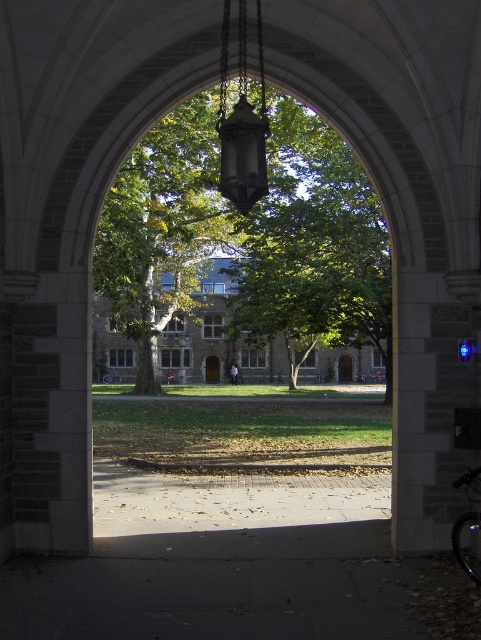
Question: Among these objects, which one is nearest to the camera?

Choices:
 (A) matte black lantern at center
 (B) green leafy tree at center

Answer: (A)

Question: Can you confirm if green leafy tree at center is smaller than matte black lantern at center?

Choices:
 (A) no
 (B) yes

Answer: (A)

Question: Does green leafy tree at center have a lesser width compared to matte black lantern at center?

Choices:
 (A) yes
 (B) no

Answer: (B)

Question: Which of the following is the closest to the observer?

Choices:
 (A) green leafy tree at center
 (B) matte black lantern at center

Answer: (B)

Question: Among these points, which one is farthest from the camera?

Choices:
 (A) (232, 186)
 (B) (354, 266)

Answer: (B)

Question: Is the position of green leafy tree at center less distant than that of matte black lantern at center?

Choices:
 (A) no
 (B) yes

Answer: (A)